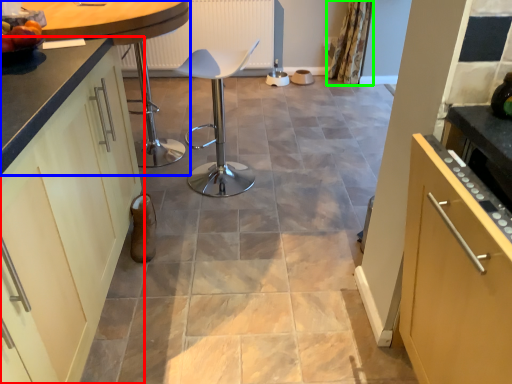
Question: Which object is the closest to the cabinetry (highlighted by a red box)? Choose among these: countertop (highlighted by a blue box) or curtain (highlighted by a green box).

Choices:
 (A) countertop
 (B) curtain

Answer: (A)